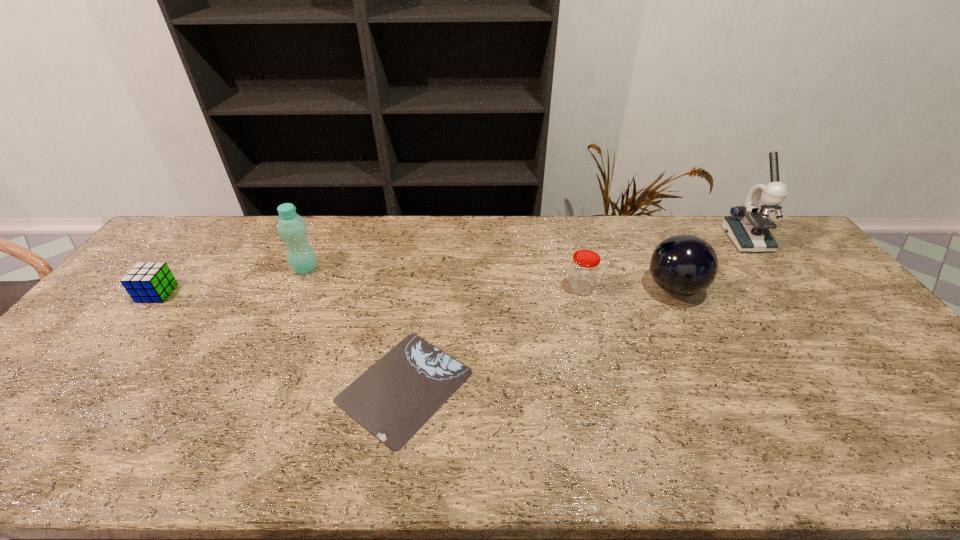
Image resolution: width=960 pixels, height=540 pixels. In order to click on mousepad in this screenshot , I will do [x=396, y=396].

This screenshot has width=960, height=540. I want to click on the shortest object, so click(396, 396).

Locate an element on the screen. The image size is (960, 540). vacant space located 0.330m at the eyepiece of the microscope is located at coordinates (813, 326).

Locate an element on the screen. The width and height of the screenshot is (960, 540). free space located 0.240m on the back of the fifth object from right to left is located at coordinates (328, 219).

Identify the location of free space located 0.110m on the side of the fourth shortest object with the finger holes. click(609, 288).

Image resolution: width=960 pixels, height=540 pixels. I want to click on vacant area located on the side of the fourth shortest object with the finger holes, so click(x=537, y=288).

At what (x,y) coordinates should I click in order to perform the action: click on free space located on the side of the fourth shortest object with the finger holes. Please return your answer as a coordinate pair (x, y). Looking at the image, I should click on (586, 288).

Identify the location of free space located on the back of the third object from right to left. (572, 255).

Identify the location of free space located 0.060m on the front of the fifth tallest object. (137, 318).

You are a GUI agent. You are given a task and a screenshot of the screen. Output one action in this format:
    pyautogui.click(x=<x>, y=<y>)
    Task: Click on the vacant region located 0.050m on the back of the fourth object from right to left
    The image size is (960, 540).
    Given the screenshot: What is the action you would take?
    pyautogui.click(x=415, y=320)